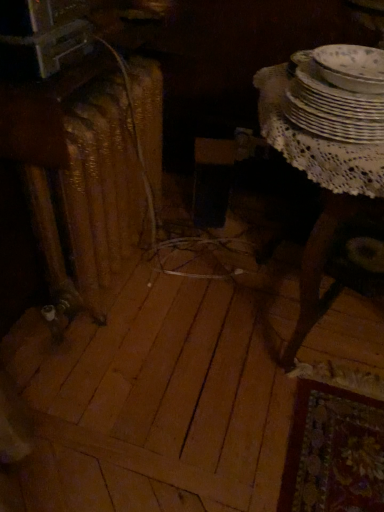
The width and height of the screenshot is (384, 512). Find the location of `vacant area on top of porcelain plates at upper right, the 1th tableware from the bottom (from a real-world perspective)`. vacant area on top of porcelain plates at upper right, the 1th tableware from the bottom (from a real-world perspective) is located at coordinates (357, 71).